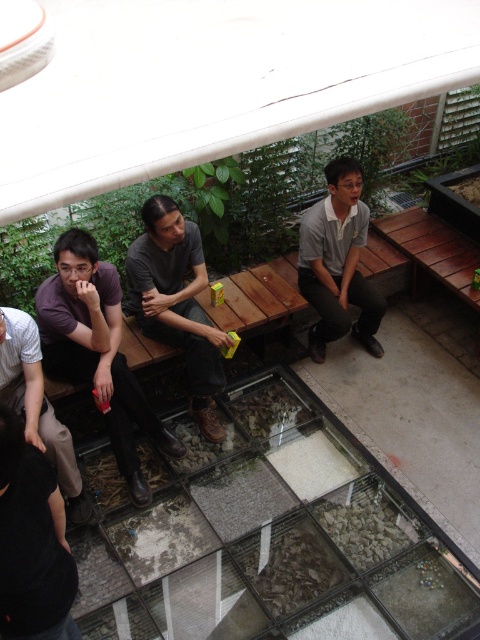
Can you confirm if matte gray shirt at center is thinner than gray matte shirt at center?

No.

Is matte gray shirt at center positioned before gray matte shirt at center?

Yes, matte gray shirt at center is in front of gray matte shirt at center.

Which is in front, point (141, 268) or point (347, 246)?

Point (141, 268)

You are a GUI agent. You are given a task and a screenshot of the screen. Output one action in this format:
    pyautogui.click(x=<x>, y=<y>)
    Task: Click on the matte gray shirt at center
    Image resolution: width=480 pixels, height=640 pixels.
    Given the screenshot: What is the action you would take?
    pyautogui.click(x=177, y=301)

Based on the photo, who is positioned more to the left, matte gray shirt at center or white striped shirt at lower left?

Positioned to the left is white striped shirt at lower left.

Which is below, matte gray shirt at center or white striped shirt at lower left?

white striped shirt at lower left

Describe the element at coordinates (177, 301) in the screenshot. This screenshot has height=640, width=480. I see `matte gray shirt at center` at that location.

This screenshot has height=640, width=480. In order to click on matte gray shirt at center in this screenshot , I will do `click(177, 301)`.

Does gray matte shirt at center have a lesser height compared to white striped shirt at lower left?

No, gray matte shirt at center is not shorter than white striped shirt at lower left.

Between gray matte shirt at center and white striped shirt at lower left, which one has more height?

With more height is gray matte shirt at center.

Image resolution: width=480 pixels, height=640 pixels. I want to click on gray matte shirt at center, so click(337, 262).

The height and width of the screenshot is (640, 480). Identify the location of gray matte shirt at center. (337, 262).